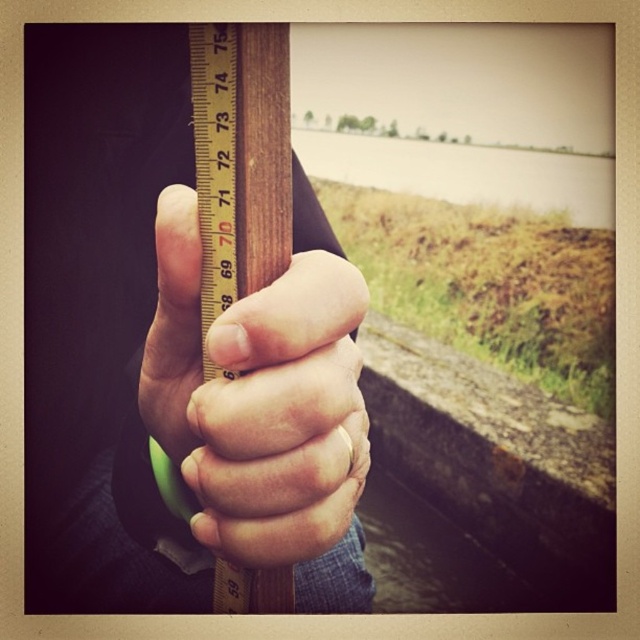
You are a photographer trying to capture the hand holding the ruler in the image. If you want to focus on the matte wood hand at center represented by point (259, 397), where should you adjust your camera focus to ensure the hand is sharp?

You should adjust your camera focus to the point (259, 397) where the matte wood hand at center is located to ensure the hand is sharp.

You are a carpenter who needs to measure a piece of wood. You have two rulers in front of you, the matte wood ruler at center and the wooden ruler at center. Which ruler is closer to your hand if you are holding the ruler at center?

The wooden ruler at center is the one you are holding, so it is closer to your hand than the matte wood ruler at center, which is 8.21 inches apart from it.

You are a carpenter trying to choose between the matte wood ruler at center and the wooden ruler at center for a precise measurement task. Which ruler should you pick if you need the one with greater width?

The matte wood ruler at center has a greater width than the wooden ruler at center, so you should choose the matte wood ruler at center for the precise measurement task.